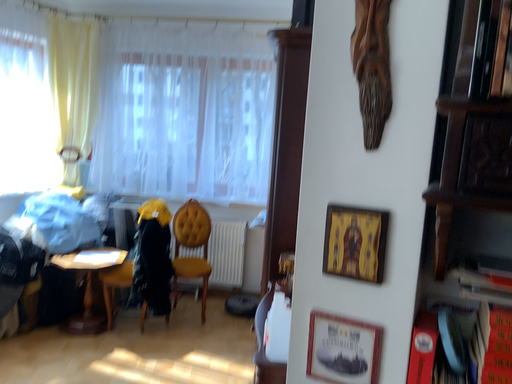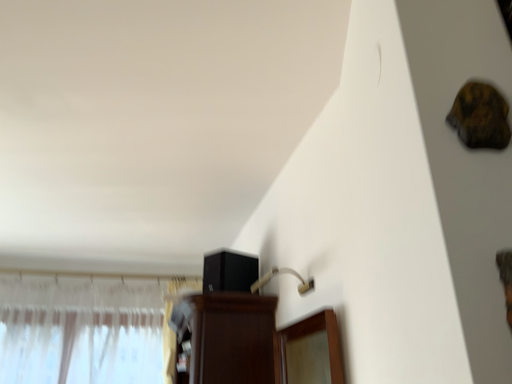
Question: Which way did the camera rotate in the video?

Choices:
 (A) rotated left
 (B) rotated right

Answer: (B)